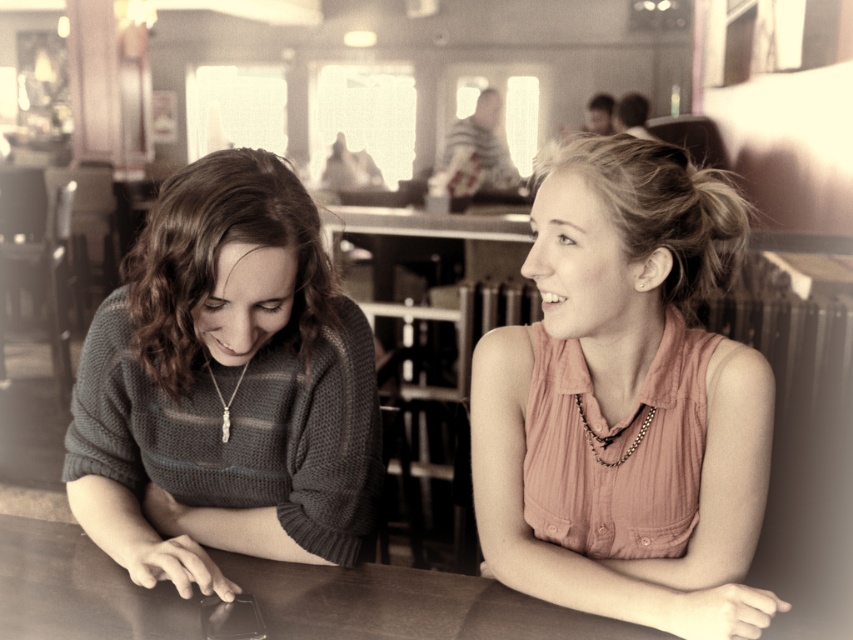
Does brown wooden table at center appear over gold chain necklace at lower center?

No.

Does point (9, 596) come in front of point (228, 419)?

Yes, point (9, 596) is in front of point (228, 419).

Who is more forward, (x=84, y=586) or (x=227, y=406)?

Point (x=84, y=586)

Find the location of `brown wooden table at center`. brown wooden table at center is located at coordinates (403, 604).

Does knitted sweater at left appear over gold chain necklace at lower center?

Correct, knitted sweater at left is located above gold chain necklace at lower center.

Is knitted sweater at left shorter than gold chain necklace at lower center?

No.

Who is more distant from viewer, (345,563) or (216,387)?

The point (216,387) is more distant.

The height and width of the screenshot is (640, 853). In order to click on knitted sweater at left in this screenshot , I will do `click(225, 387)`.

Is point (711, 362) less distant than point (222, 422)?

Yes, it is in front of point (222, 422).

Can you confirm if pink fabric shirt at upper right is thinner than gold chain necklace at lower center?

Incorrect, pink fabric shirt at upper right's width is not less than gold chain necklace at lower center's.

Where is `pink fabric shirt at upper right`? This screenshot has height=640, width=853. pink fabric shirt at upper right is located at coordinates (625, 403).